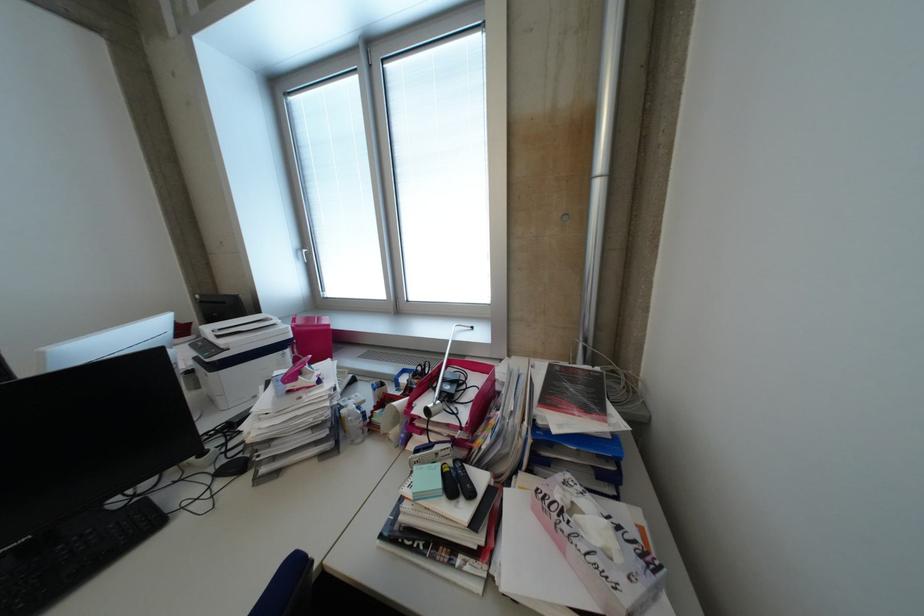
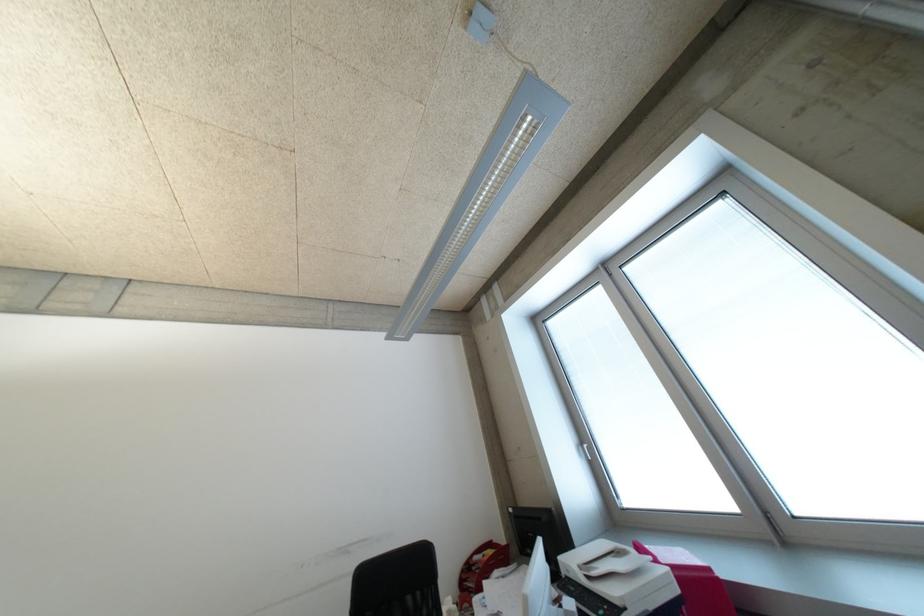
In the scene shown: The images are taken continuously from a first-person perspective. In which direction is your viewpoint rotating?

The rotation direction of the camera is left-up.